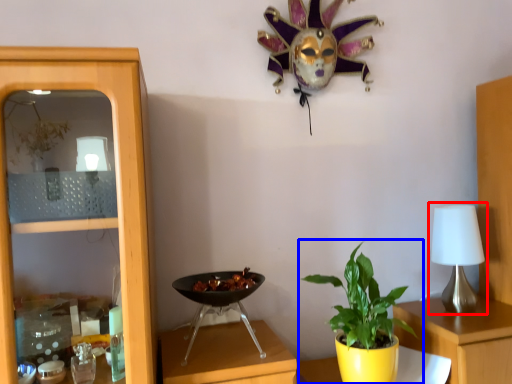
Question: Which of the following is the farthest to the observer, table lamp (highlighted by a red box) or houseplant (highlighted by a blue box)?

Choices:
 (A) table lamp
 (B) houseplant

Answer: (A)